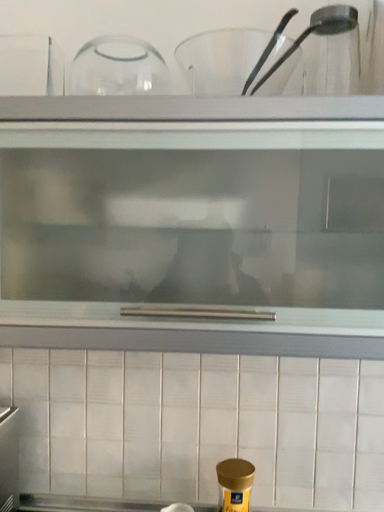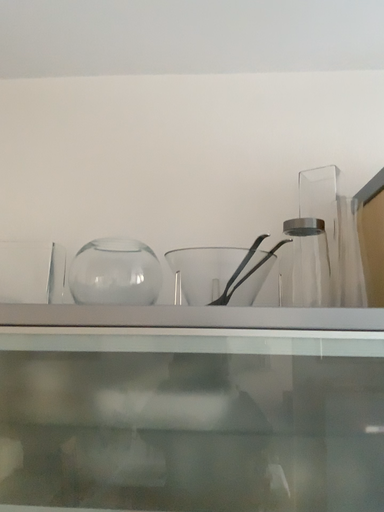
Question: Which way did the camera rotate in the video?

Choices:
 (A) rotated downward
 (B) rotated upward

Answer: (B)